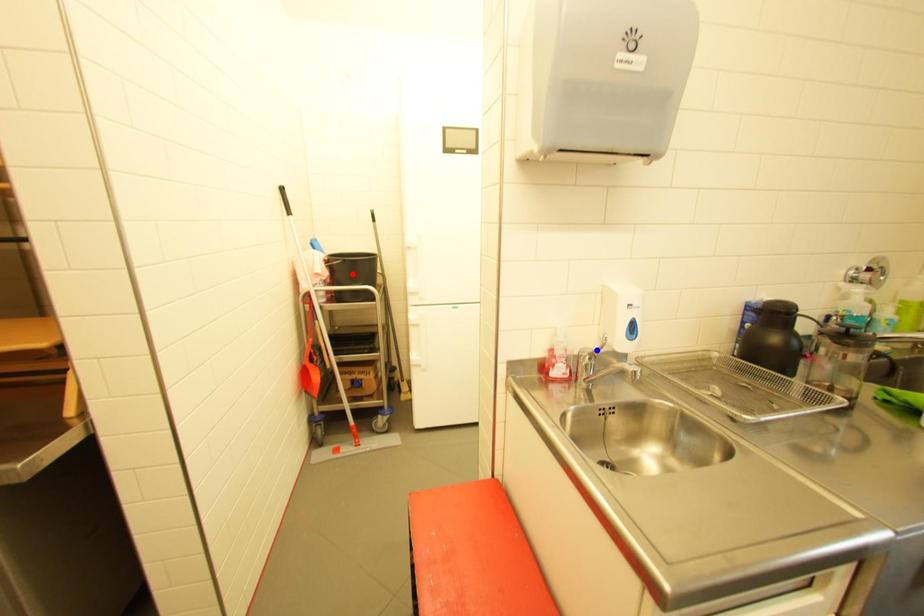
Question: In the image, two points are highlighted. Which point is nearer to the camera? Reply with the corresponding letter.

Choices:
 (A) blue point
 (B) red point

Answer: (A)